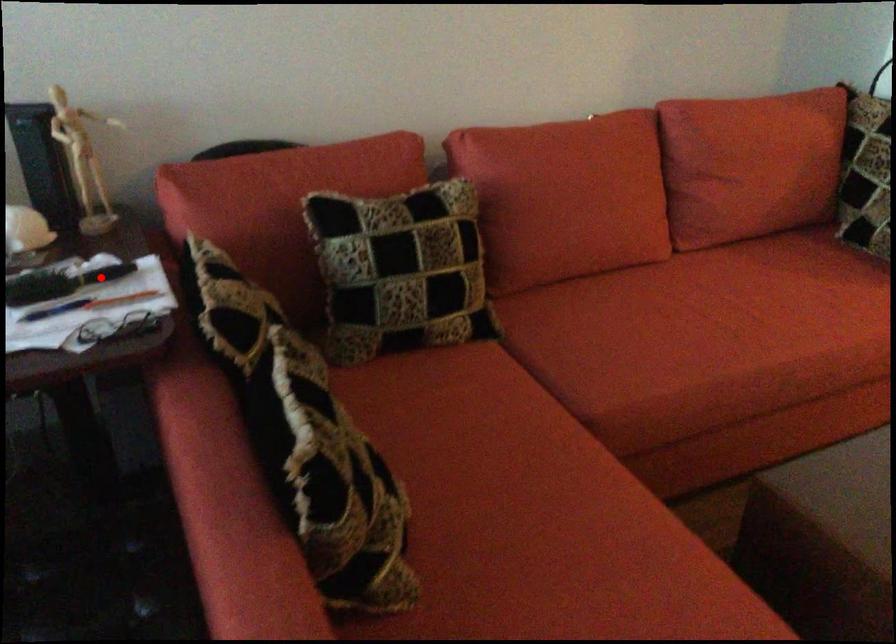
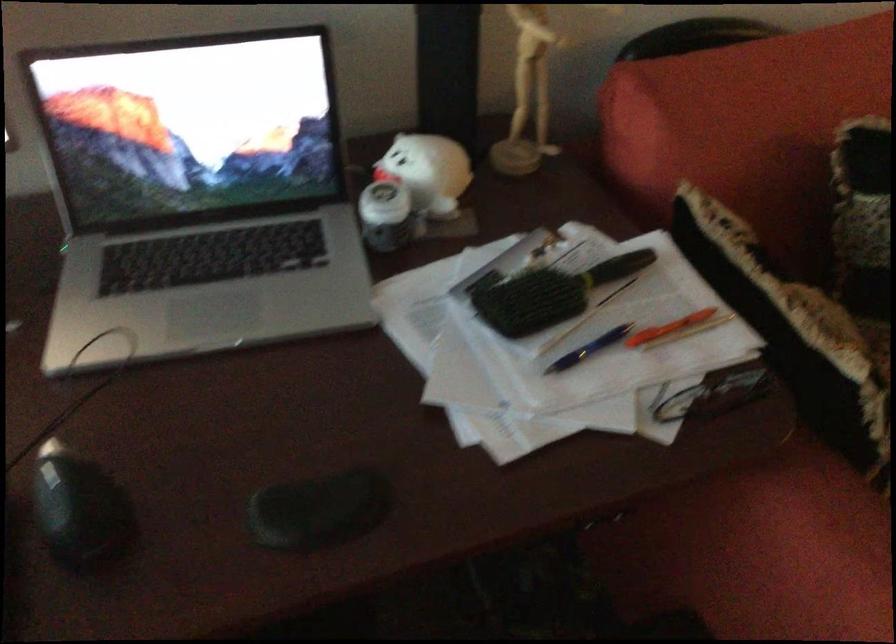
Question: I am providing you with two images of the same scene from different viewpoints. Given a red point in image1, look at the same physical point in image2. Is it:

Choices:
 (A) Closer to the viewpoint
 (B) Farther from the viewpoint

Answer: (A)